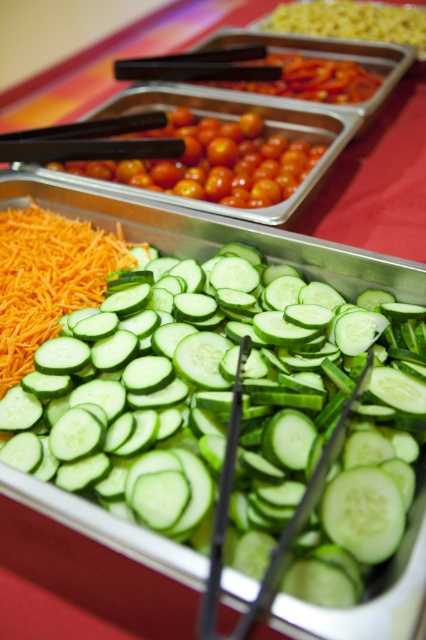
Question: Which of the following is the closest to the observer?

Choices:
 (A) glossy cherry tomatoes at center
 (B) green smooth cucumber at center

Answer: (B)

Question: Can you confirm if green smooth cucumber at center is positioned to the right of glossy cherry tomatoes at center?

Choices:
 (A) no
 (B) yes

Answer: (B)

Question: Can you confirm if green smooth cucumber at center is positioned to the right of glossy cherry tomatoes at center?

Choices:
 (A) yes
 (B) no

Answer: (A)

Question: Is green smooth cucumber at center above glossy cherry tomatoes at center?

Choices:
 (A) yes
 (B) no

Answer: (B)

Question: Which point appears closest to the camera in this image?

Choices:
 (A) (255, 321)
 (B) (265, 141)

Answer: (A)

Question: Which point appears farthest from the camera in this image?

Choices:
 (A) (382, 422)
 (B) (199, 157)

Answer: (B)